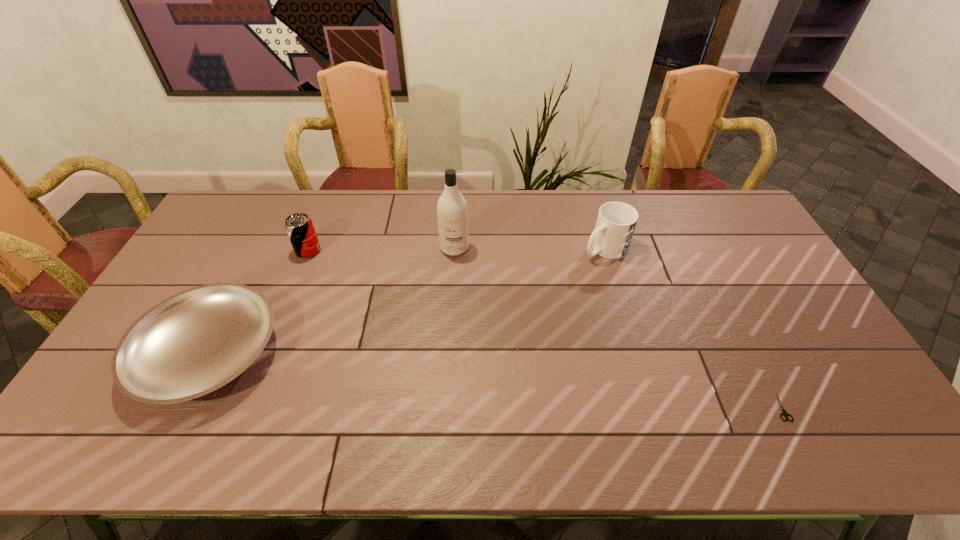
Where is `free space between the second object from right to left and the third object from left to right`? This screenshot has height=540, width=960. free space between the second object from right to left and the third object from left to right is located at coordinates 530,248.

The width and height of the screenshot is (960, 540). Identify the location of free space between the fourth object from left to right and the rightmost object. (692, 327).

You are a GUI agent. You are given a task and a screenshot of the screen. Output one action in this format:
    pyautogui.click(x=<x>, y=<y>)
    Task: Click on the free space that is in between the third object from left to right and the second shortest object
    The width and height of the screenshot is (960, 540).
    Given the screenshot: What is the action you would take?
    pyautogui.click(x=331, y=301)

You are a GUI agent. You are given a task and a screenshot of the screen. Output one action in this format:
    pyautogui.click(x=<x>, y=<y>)
    Task: Click on the vacant point located between the third object from left to right and the bedpan
    This screenshot has width=960, height=540.
    Given the screenshot: What is the action you would take?
    pyautogui.click(x=331, y=301)

Locate an element on the screen. The width and height of the screenshot is (960, 540). free space that is in between the rightmost object and the mug is located at coordinates (692, 327).

Image resolution: width=960 pixels, height=540 pixels. Identify the location of free space between the fourth tallest object and the shampoo. (331, 301).

Image resolution: width=960 pixels, height=540 pixels. Find the location of `free space between the soda can and the tallest object`. free space between the soda can and the tallest object is located at coordinates (381, 249).

Image resolution: width=960 pixels, height=540 pixels. Find the location of `object that is the closest to the soda can`. object that is the closest to the soda can is located at coordinates (193, 343).

Find the location of a particular element. the second closest object to the rightmost object is located at coordinates (452, 212).

Where is `vacant area that satisfies the following two spatial constraints: 1. on the front-facing side of the mug; 2. on the right side of the third object from right to left`? The image size is (960, 540). vacant area that satisfies the following two spatial constraints: 1. on the front-facing side of the mug; 2. on the right side of the third object from right to left is located at coordinates (454, 249).